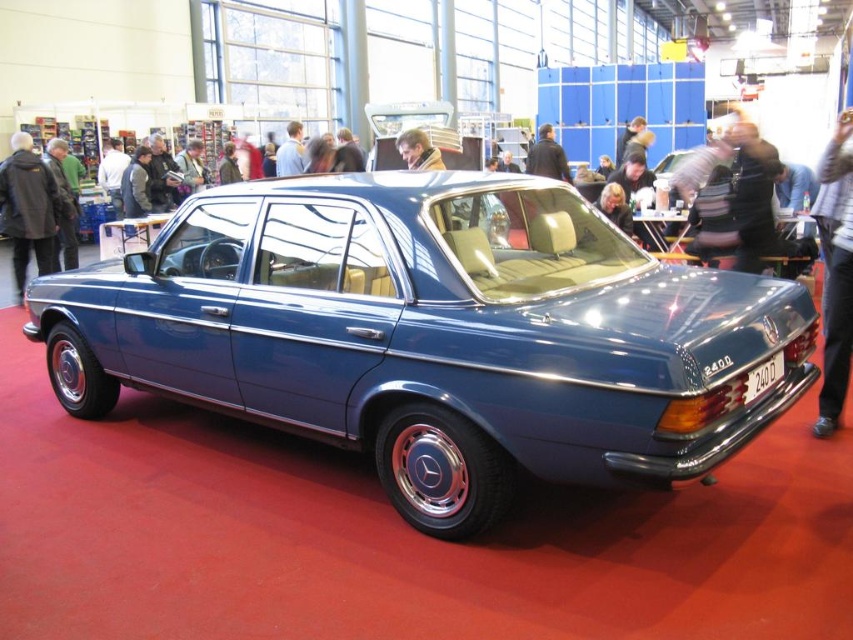
Which is above, metallic blue sedan at center or dark blue leather jacket at upper center?

dark blue leather jacket at upper center is higher up.

Is point (331, 403) behind point (531, 148)?

No, it is in front of (531, 148).

Locate an element on the screen. The height and width of the screenshot is (640, 853). metallic blue sedan at center is located at coordinates (434, 333).